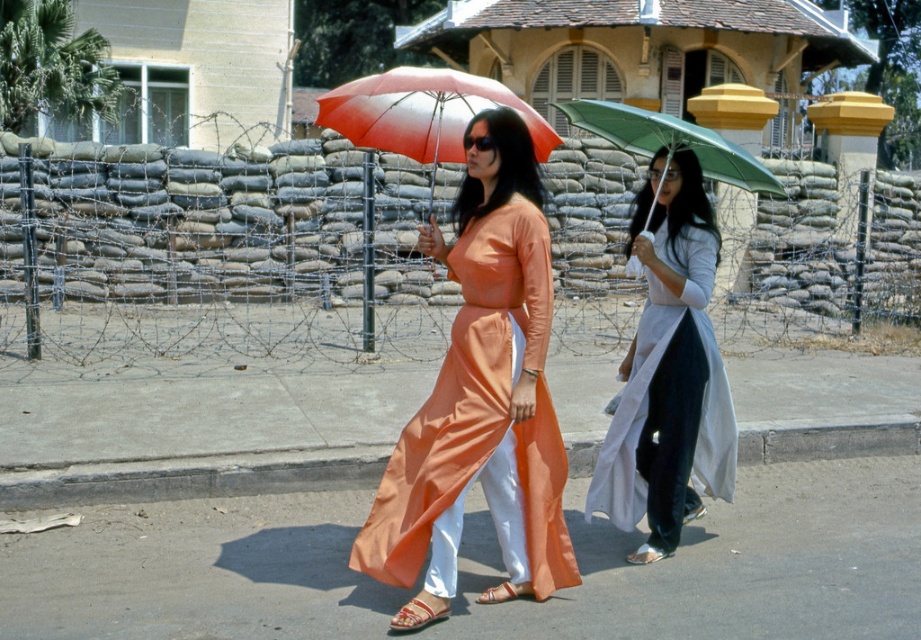
Question: Is white silk ao dai at center to the right of red matte umbrella at center from the viewer's perspective?

Choices:
 (A) no
 (B) yes

Answer: (B)

Question: Which of these objects is positioned farthest from the smooth asphalt at lower center?

Choices:
 (A) green matte umbrella at center
 (B) red matte umbrella at center

Answer: (B)

Question: Does white silk ao dai at center come behind green matte umbrella at center?

Choices:
 (A) no
 (B) yes

Answer: (A)

Question: Among these points, which one is farthest from the camera?

Choices:
 (A) (422, 120)
 (B) (494, 115)
 (C) (655, 627)
 (D) (638, 344)

Answer: (D)

Question: Among these objects, which one is nearest to the camera?

Choices:
 (A) smooth asphalt at lower center
 (B) red matte umbrella at center
 (C) white silk ao dai at center

Answer: (B)

Question: Is red matte umbrella at center further to the viewer compared to green matte umbrella at center?

Choices:
 (A) yes
 (B) no

Answer: (B)